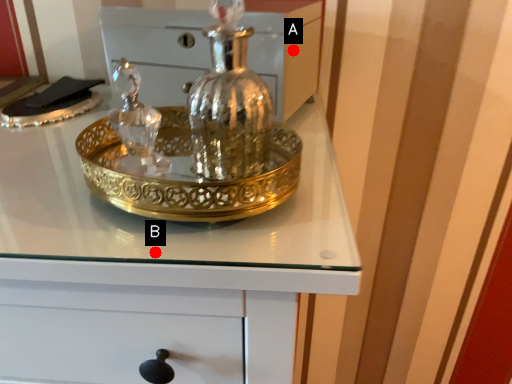
Question: Two points are circled on the image, labeled by A and B beside each circle. Which of the following is the closest to the observer?

Choices:
 (A) A is closer
 (B) B is closer

Answer: (B)